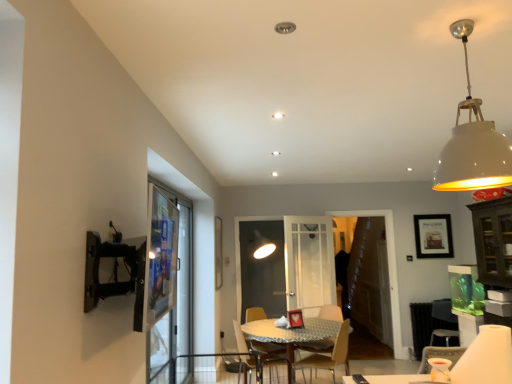
This screenshot has width=512, height=384. Describe the element at coordinates (370, 279) in the screenshot. I see `transparent glass screen door at center, the 2th screen door in the front-to-back sequence` at that location.

Identify the location of white matte lampshade at upper right. Image resolution: width=512 pixels, height=384 pixels. (473, 142).

Measure the distance between point (265, 334) and camera.

The depth of point (265, 334) is 4.16 meters.

In order to click on transparent glass screen door at center, the 2th screen door from the right in this screenshot , I will do `click(262, 269)`.

From a real-world perspective, relative to transparent glass screen door at left, positioned as the 3th screen door in right-to-left order, is white matte lampshade at upper right vertically above or below?

white matte lampshade at upper right is situated higher than transparent glass screen door at left, positioned as the 3th screen door in right-to-left order, in the real world.

From the image's perspective, is white matte lampshade at upper right above transparent glass screen door at left, which is the first screen door from left to right?

Indeed, from the image's perspective, white matte lampshade at upper right is shown above transparent glass screen door at left, which is the first screen door from left to right.

Considering the relative sizes of white matte lampshade at upper right and transparent glass screen door at left, the 3th screen door in the back-to-front sequence, in the image provided, is white matte lampshade at upper right wider than transparent glass screen door at left, the 3th screen door in the back-to-front sequence,?

Indeed, white matte lampshade at upper right has a greater width compared to transparent glass screen door at left, the 3th screen door in the back-to-front sequence.

Can you confirm if matte black picture frame at upper right is shorter than wooden chair at center, acting as the second chair starting from the right?

Indeed, matte black picture frame at upper right has a lesser height compared to wooden chair at center, acting as the second chair starting from the right.

Which is behind, point (439, 249) or point (287, 347)?

The point (439, 249) is farther.

What's the angular difference between matte black picture frame at upper right and wooden chair at center, acting as the second chair starting from the right,'s facing directions?

The angular difference between matte black picture frame at upper right and wooden chair at center, acting as the second chair starting from the right, is 110 degrees.

Can you see matte black picture frame at upper right touching wooden chair at center, acting as the first chair starting from the left?

No, matte black picture frame at upper right is not with wooden chair at center, acting as the first chair starting from the left.

Can you confirm if wooden chair at center, acting as the second chair starting from the right, is smaller than wooden table at center?

Correct, wooden chair at center, acting as the second chair starting from the right, occupies less space than wooden table at center.

From a real-world perspective, which is physically above, wooden chair at center, acting as the second chair starting from the right, or wooden table at center?

wooden chair at center, acting as the second chair starting from the right.

Consider the image. Could you tell me if wooden chair at center, acting as the first chair starting from the left, is facing wooden table at center?

Yes, wooden chair at center, acting as the first chair starting from the left, is aimed at wooden table at center.

Is wooden chair at center, acting as the second chair starting from the right, next to wooden table at center and touching it?

Yes, wooden chair at center, acting as the second chair starting from the right, is with wooden table at center.

From a real-world perspective, is wooden chair at center, the first chair when ordered from right to left, below transparent glass screen door at center, which ranks as the 1th screen door in back-to-front order?

Yes, from a real-world perspective, wooden chair at center, the first chair when ordered from right to left, is below transparent glass screen door at center, which ranks as the 1th screen door in back-to-front order.

Does wooden chair at center, which is the second chair from left to right, come in front of transparent glass screen door at center, marked as the 3th screen door in a front-to-back arrangement?

Yes, wooden chair at center, which is the second chair from left to right, is in front of transparent glass screen door at center, marked as the 3th screen door in a front-to-back arrangement.

How many degrees apart are the facing directions of wooden chair at center, which is the second chair from left to right, and transparent glass screen door at center, positioned as the 2th screen door in left-to-right order?

112 degrees separate the facing orientations of wooden chair at center, which is the second chair from left to right, and transparent glass screen door at center, positioned as the 2th screen door in left-to-right order.

Looking at the image, does wooden chair at center, acting as the first chair starting from the left, seem bigger or smaller compared to transparent glass screen door at center, the 2th screen door in the front-to-back sequence?

Considering their sizes, wooden chair at center, acting as the first chair starting from the left, takes up less space than transparent glass screen door at center, the 2th screen door in the front-to-back sequence.

Who is more distant, wooden chair at center, acting as the second chair starting from the right, or transparent glass screen door at center, placed as the third screen door when sorted from left to right?

transparent glass screen door at center, placed as the third screen door when sorted from left to right, is further away from the camera.

Which of these two, wooden chair at center, acting as the second chair starting from the right, or transparent glass screen door at center, positioned as the second screen door in back-to-front order, stands shorter?

wooden chair at center, acting as the second chair starting from the right.

From the image's perspective, which is below, wooden chair at center, acting as the first chair starting from the left, or transparent glass screen door at center, the 2th screen door in the front-to-back sequence?

wooden chair at center, acting as the first chair starting from the left, from the image's perspective.

Considering the relative sizes of transparent glass screen door at center, which ranks as the 1th screen door in back-to-front order, and wooden chair at center, which is the second chair from left to right, in the image provided, is transparent glass screen door at center, which ranks as the 1th screen door in back-to-front order, bigger than wooden chair at center, which is the second chair from left to right,?

No, transparent glass screen door at center, which ranks as the 1th screen door in back-to-front order, is not bigger than wooden chair at center, which is the second chair from left to right.

Does transparent glass screen door at center, positioned as the 2th screen door in left-to-right order, have a lesser width compared to wooden chair at center, which is the second chair from left to right?

Correct, the width of transparent glass screen door at center, positioned as the 2th screen door in left-to-right order, is less than that of wooden chair at center, which is the second chair from left to right.

Where is `chair located on the right of transparent glass screen door at center, which ranks as the 1th screen door in back-to-front order`? The height and width of the screenshot is (384, 512). chair located on the right of transparent glass screen door at center, which ranks as the 1th screen door in back-to-front order is located at coordinates (328, 356).

Which is more to the left, transparent glass screen door at center, marked as the 3th screen door in a front-to-back arrangement, or wooden chair at center, the first chair when ordered from right to left?

From the viewer's perspective, transparent glass screen door at center, marked as the 3th screen door in a front-to-back arrangement, appears more on the left side.

From a real-world perspective, is transparent glass screen door at center, placed as the third screen door when sorted from left to right, on wooden table at center?

Yes, from a real-world perspective, transparent glass screen door at center, placed as the third screen door when sorted from left to right, is above wooden table at center.

Between point (384, 278) and point (313, 322), which one is positioned behind?

Positioned behind is point (384, 278).

How many degrees apart are the facing directions of transparent glass screen door at center, the first screen door in the right-to-left sequence, and wooden table at center?

The angular difference between transparent glass screen door at center, the first screen door in the right-to-left sequence, and wooden table at center is 87.6 degrees.

The width and height of the screenshot is (512, 384). Identify the location of lamp above the transparent glass screen door at left, positioned as the 3th screen door in right-to-left order (from a real-world perspective). (473, 142).

Identify the location of the 1st chair in front when counting from the matte black picture frame at upper right. The height and width of the screenshot is (384, 512). (265, 331).

Considering their positions, is transparent glass screen door at center, the 2th screen door from the right, positioned further to matte black picture frame at upper right than wooden table at center?

The object further to matte black picture frame at upper right is transparent glass screen door at center, the 2th screen door from the right.

Estimate the real-world distances between objects in this image. Which object is further from white matte lampshade at upper right, wooden chair at center, the first chair when ordered from right to left, or wooden table at center?

wooden chair at center, the first chair when ordered from right to left, is positioned further to the anchor white matte lampshade at upper right.

Which object lies nearer to the anchor point white matte lampshade at upper right, wooden table at center or transparent glass screen door at center, the 2th screen door from the right?

wooden table at center is positioned closer to the anchor white matte lampshade at upper right.

Which object lies nearer to the anchor point white matte lampshade at upper right, transparent glass screen door at left, positioned as the 3th screen door in right-to-left order, or wooden chair at center, the first chair when ordered from right to left?

Among the two, wooden chair at center, the first chair when ordered from right to left, is located nearer to white matte lampshade at upper right.

Based on their spatial positions, is transparent glass screen door at center, marked as the 3th screen door in a front-to-back arrangement, or wooden chair at center, acting as the first chair starting from the left, further from wooden chair at center, the first chair when ordered from right to left?

The object further to wooden chair at center, the first chair when ordered from right to left, is transparent glass screen door at center, marked as the 3th screen door in a front-to-back arrangement.

Looking at this image, considering their positions, is wooden table at center positioned further to matte black picture frame at upper right than wooden chair at center, which is the second chair from left to right?

wooden table at center is further to matte black picture frame at upper right.

Estimate the real-world distances between objects in this image. Which object is further from transparent glass screen door at left, which appears as the first screen door when viewed from the front, wooden chair at center, the first chair when ordered from right to left, or transparent glass screen door at center, the first screen door in the right-to-left sequence?

Among the two, transparent glass screen door at center, the first screen door in the right-to-left sequence, is located further to transparent glass screen door at left, which appears as the first screen door when viewed from the front.

From the picture: Considering their positions, is wooden chair at center, the first chair when ordered from right to left, positioned closer to transparent glass screen door at left, the 3th screen door in the back-to-front sequence, than transparent glass screen door at center, which ranks as the 1th screen door in back-to-front order?

wooden chair at center, the first chair when ordered from right to left, is closer to transparent glass screen door at left, the 3th screen door in the back-to-front sequence.

The image size is (512, 384). In order to click on table between wooden chair at center, acting as the first chair starting from the left, and wooden chair at center, the first chair when ordered from right to left, in the horizontal direction in this screenshot , I will do `click(290, 335)`.

Find the location of a particular element. The height and width of the screenshot is (384, 512). table between transparent glass screen door at left, which is the first screen door from left to right, and matte black picture frame at upper right is located at coordinates (290, 335).

The height and width of the screenshot is (384, 512). Identify the location of chair between wooden chair at center, which is the second chair from left to right, and transparent glass screen door at center, positioned as the second screen door in back-to-front order, from front to back. (265, 331).

The width and height of the screenshot is (512, 384). Find the location of `table located between white matte lampshade at upper right and wooden chair at center, acting as the first chair starting from the left, in the depth direction`. table located between white matte lampshade at upper right and wooden chair at center, acting as the first chair starting from the left, in the depth direction is located at coordinates (290, 335).